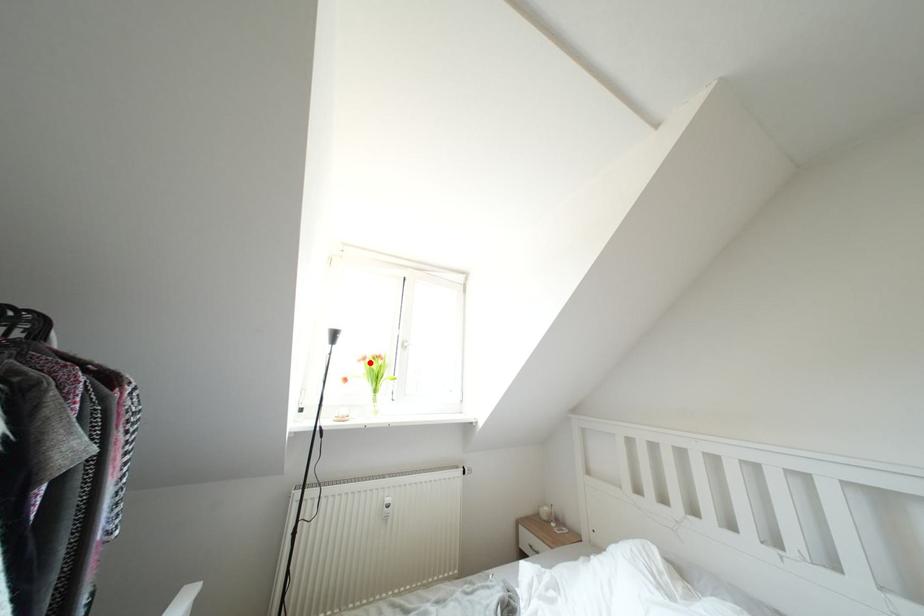
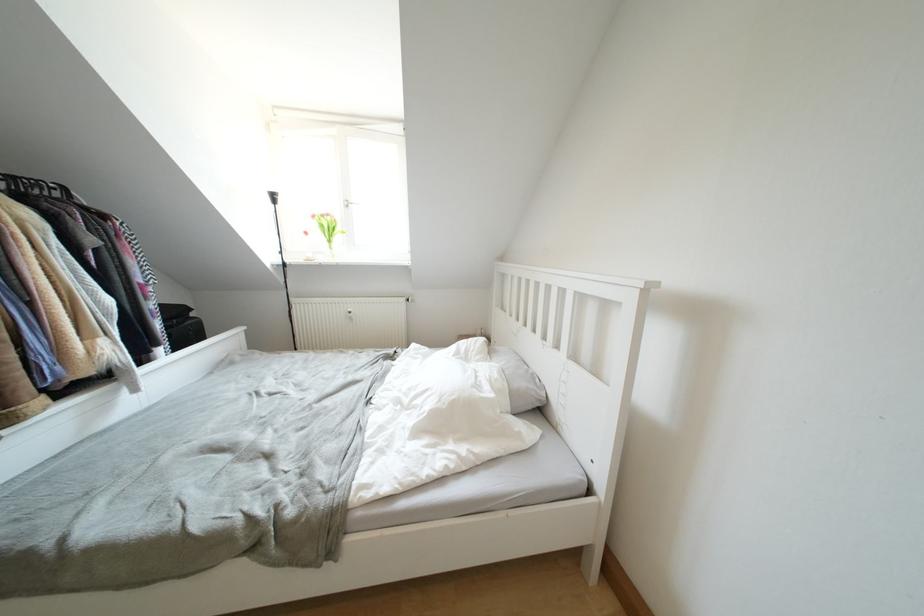
Question: I am providing you with two images of the same scene from different viewpoints. A red point is shown in image1. For the corresponding object point in image2, is it positioned nearer or farther from the camera?

Choices:
 (A) Nearer
 (B) Farther

Answer: (A)